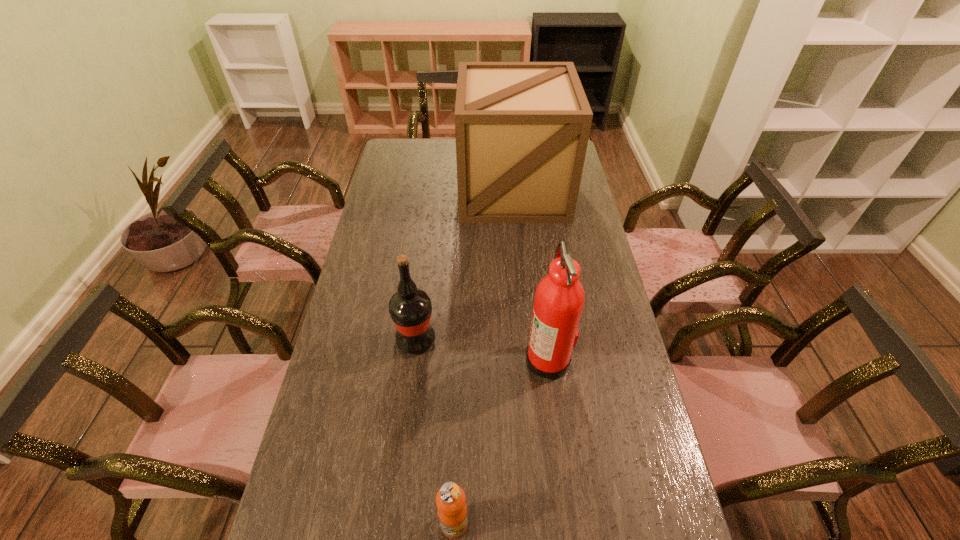
Where is `box`? box is located at coordinates (x=522, y=128).

Where is `fire extinguisher`? This screenshot has height=540, width=960. fire extinguisher is located at coordinates 559,298.

The image size is (960, 540). Find the location of `the leftmost object`. the leftmost object is located at coordinates (410, 308).

Where is `the third tallest object`? Image resolution: width=960 pixels, height=540 pixels. the third tallest object is located at coordinates (410, 308).

At what (x,y) coordinates should I click in order to perform the action: click on fruit juice. Please return your answer as a coordinate pair (x, y). Looking at the image, I should click on (450, 499).

Find the location of a particular element. This screenshot has height=540, width=960. the nearest object is located at coordinates (450, 499).

The height and width of the screenshot is (540, 960). What are the coordinates of `vacant point located on the reinforced sides of the farthest object` in the screenshot? It's located at (518, 253).

The image size is (960, 540). I want to click on vacant region located on the label side of the fire extinguisher, so pos(426,358).

Identify the location of vacant area located on the label side of the fire extinguisher. The image size is (960, 540). (472, 358).

I want to click on vacant space located on the label side of the fire extinguisher, so click(x=446, y=358).